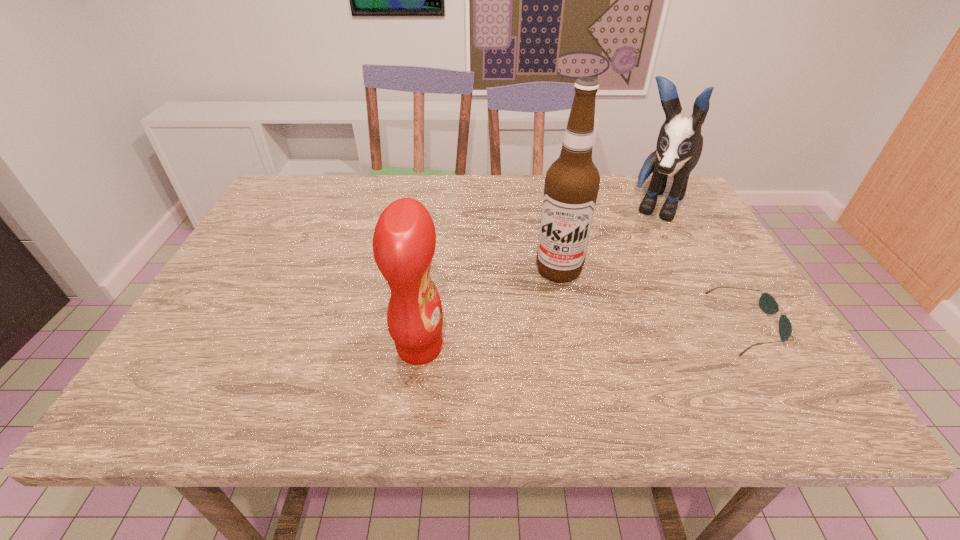
Identify the location of vacant region located 0.340m on the front-facing side of the third shortest object. The width and height of the screenshot is (960, 540). (609, 314).

Where is `free space located 0.170m on the label of the alcohol`? free space located 0.170m on the label of the alcohol is located at coordinates [543, 341].

Find the location of a particular element. free space located 0.100m on the label of the alcohol is located at coordinates pyautogui.click(x=548, y=316).

At what (x,y) coordinates should I click in order to perform the action: click on vacant space situated 0.240m on the label of the alcohol. Please return your answer as a coordinate pair (x, y). Looking at the image, I should click on (538, 368).

Where is `object present at the far edge`? The width and height of the screenshot is (960, 540). object present at the far edge is located at coordinates (679, 146).

Identify the location of condiment at the near edge. This screenshot has height=540, width=960. (404, 240).

Locate an element on the screen. The width and height of the screenshot is (960, 540). sunglasses located in the near edge section of the desktop is located at coordinates (767, 303).

Where is `sunglasses located in the right edge section of the desktop`? The height and width of the screenshot is (540, 960). sunglasses located in the right edge section of the desktop is located at coordinates (767, 303).

The width and height of the screenshot is (960, 540). I want to click on puppy at the right edge, so click(x=679, y=146).

Find the location of a particular element. The image size is (960, 540). object positioned at the far right corner is located at coordinates (679, 146).